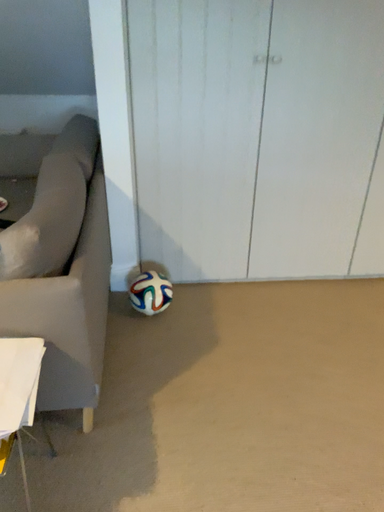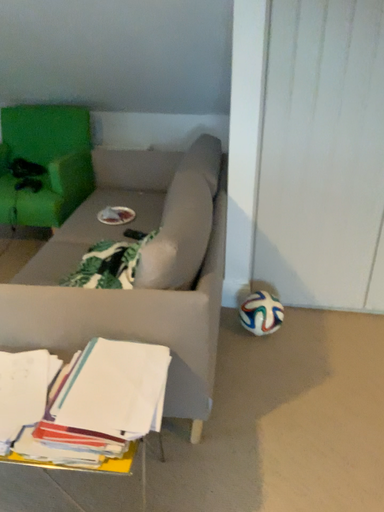
Question: How did the camera likely rotate when shooting the video?

Choices:
 (A) rotated left
 (B) rotated right

Answer: (A)